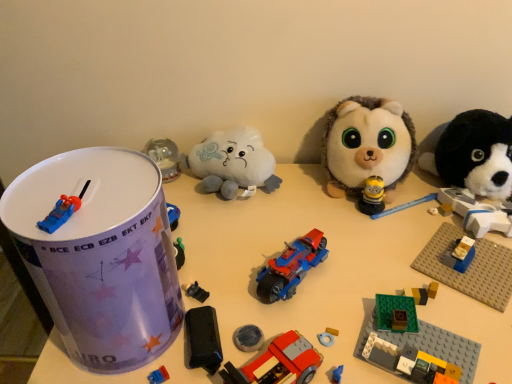
The width and height of the screenshot is (512, 384). I want to click on free location to the right of shiny plastic toy car at left, the eighth toy positioned from the right, so click(x=258, y=291).